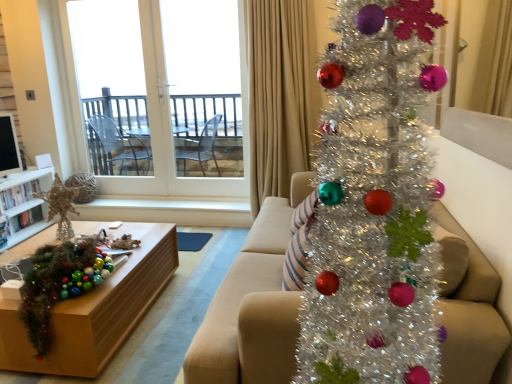
This screenshot has height=384, width=512. What do you see at coordinates (252, 307) in the screenshot?
I see `matte beige couch at center` at bounding box center [252, 307].

The image size is (512, 384). In order to click on white glass door at upper left in this screenshot , I will do `click(168, 89)`.

This screenshot has height=384, width=512. In order to click on wooden table at lower left in this screenshot , I will do `click(96, 310)`.

From the image's perspective, which one is positioned lower, wooden table at lower left or beige fabric curtain at upper right?

wooden table at lower left, from the image's perspective.

Is point (127, 333) closer or farther from the camera than point (282, 10)?

Point (127, 333).

Between wooden table at lower left and beige fabric curtain at upper right, which one is positioned behind?

beige fabric curtain at upper right is more distant.

Who is taller, wooden table at lower left or beige fabric curtain at upper right?

With more height is beige fabric curtain at upper right.

Is matte beige couch at center to the right of beige fabric curtain at upper right from the viewer's perspective?

Yes.

Considering the relative sizes of matte beige couch at center and beige fabric curtain at upper right in the image provided, is matte beige couch at center thinner than beige fabric curtain at upper right?

No, matte beige couch at center is not thinner than beige fabric curtain at upper right.

From a real-world perspective, between matte beige couch at center and beige fabric curtain at upper right, who is vertically higher?

beige fabric curtain at upper right is physically above.

Who is smaller, beige fabric curtain at upper right or wooden table at lower left?

wooden table at lower left is smaller.

From the image's perspective, is beige fabric curtain at upper right beneath wooden table at lower left?

Actually, beige fabric curtain at upper right appears above wooden table at lower left in the image.

Which point is more forward, (253, 140) or (104, 339)?

Positioned in front is point (104, 339).

Does matte beige couch at center turn towards shiny green tinsel garland at lower left?

Yes, matte beige couch at center faces towards shiny green tinsel garland at lower left.

Who is shorter, matte beige couch at center or shiny green tinsel garland at lower left?

With less height is shiny green tinsel garland at lower left.

Measure the distance from matte beige couch at center to shiny green tinsel garland at lower left.

29.87 inches.

Which object is positioned more to the left, matte beige couch at center or shiny green tinsel garland at lower left?

shiny green tinsel garland at lower left is more to the left.

From a real-world perspective, between white glass door at upper left and beige fabric curtain at upper right, who is vertically higher?

white glass door at upper left, from a real-world perspective.

Is point (133, 193) closer or farther from the camera than point (307, 54)?

Point (133, 193) appears to be farther away from the viewer than point (307, 54).

Are white glass door at upper left and beige fabric curtain at upper right located far from each other?

Actually, white glass door at upper left and beige fabric curtain at upper right are a little close together.

Considering the sizes of white glass door at upper left and shiny green tinsel garland at lower left in the image, is white glass door at upper left wider or thinner than shiny green tinsel garland at lower left?

Clearly, white glass door at upper left has less width compared to shiny green tinsel garland at lower left.

Between white glass door at upper left and shiny green tinsel garland at lower left, which one has smaller size?

Smaller between the two is shiny green tinsel garland at lower left.

Is white glass door at upper left inside or outside of shiny green tinsel garland at lower left?

The correct answer is: outside.

Is shiny green tinsel garland at lower left located outside white glass door at upper left?

That's correct, shiny green tinsel garland at lower left is outside of white glass door at upper left.

From the image's perspective, is shiny green tinsel garland at lower left above or below white glass door at upper left?

From the image's perspective, shiny green tinsel garland at lower left appears below white glass door at upper left.

How many degrees apart are the facing directions of shiny green tinsel garland at lower left and white glass door at upper left?

There is a 93.8-degree angle between the facing directions of shiny green tinsel garland at lower left and white glass door at upper left.

Identify the location of curtain that appears on the right of wooden table at lower left. click(x=280, y=94).

There is a matte beige couch at center. Identify the location of curtain above it (from a real-world perspective). (280, 94).

When comparing their distances from matte beige couch at center, does white glass door at upper left or beige fabric curtain at upper right seem further?

Among the two, white glass door at upper left is located further to matte beige couch at center.

Based on the photo, based on their spatial positions, is beige fabric curtain at upper right or wooden table at lower left closer to matte beige couch at center?

wooden table at lower left is closer to matte beige couch at center.

Looking at this image, from the image, which object appears to be farther from white glass door at upper left, wooden table at lower left or shiny green tinsel garland at lower left?

The object further to white glass door at upper left is shiny green tinsel garland at lower left.

Estimate the real-world distances between objects in this image. Which object is further from beige fabric curtain at upper right, white glass door at upper left or wooden table at lower left?

Among the two, wooden table at lower left is located further to beige fabric curtain at upper right.

Considering their positions, is matte beige couch at center positioned further to white glass door at upper left than wooden table at lower left?

matte beige couch at center lies further to white glass door at upper left than the other object.

Based on their spatial positions, is wooden table at lower left or white glass door at upper left further from matte beige couch at center?

white glass door at upper left is further to matte beige couch at center.

In the scene shown: Which object lies nearer to the anchor point wooden table at lower left, beige fabric curtain at upper right or shiny green tinsel garland at lower left?

shiny green tinsel garland at lower left lies closer to wooden table at lower left than the other object.

Looking at the image, which one is located further to white glass door at upper left, beige fabric curtain at upper right or matte beige couch at center?

Among the two, matte beige couch at center is located further to white glass door at upper left.

The height and width of the screenshot is (384, 512). Find the location of `christmas decoration between matte beige couch at center and white glass door at upper left from front to back`. christmas decoration between matte beige couch at center and white glass door at upper left from front to back is located at coordinates (57, 284).

The width and height of the screenshot is (512, 384). Find the location of `curtain between matte beige couch at center and white glass door at upper left along the z-axis`. curtain between matte beige couch at center and white glass door at upper left along the z-axis is located at coordinates tap(280, 94).

Where is `table positioned between matte beige couch at center and beige fabric curtain at upper right from near to far`? This screenshot has height=384, width=512. table positioned between matte beige couch at center and beige fabric curtain at upper right from near to far is located at coordinates coord(96,310).

Where is `christmas decoration located between matte beige couch at center and beige fabric curtain at upper right in the depth direction`? christmas decoration located between matte beige couch at center and beige fabric curtain at upper right in the depth direction is located at coordinates (57, 284).